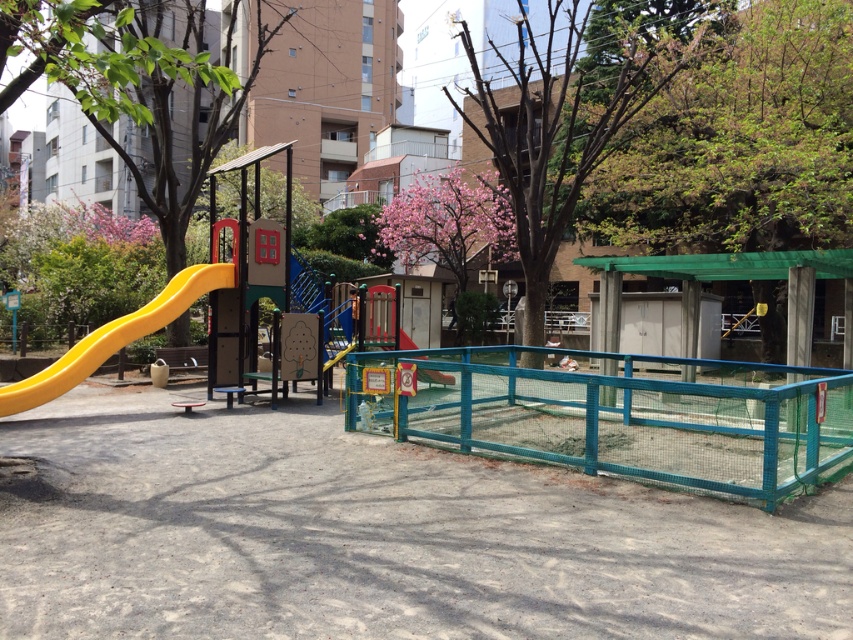
You are a parent trying to guide your child to the yellow matte slide at left from the bare wood tree at center. Which direction should you move relative to the tree?

You should move towards the left relative to the bare wood tree at center because the yellow matte slide at left is positioned to the left side of the frame, while the tree is centrally located.

Based on the photo, you are standing at the playground and want to walk from the slide to the fence. You see two points marked in the image. The first point is at coordinate point (553,83) and the second point is at coordinate point (51,369). Which point is closer to you as you stand at the slide?

Point (553,83) is closer to you because it is further to the viewer than point (51,369), meaning it is nearer in the scene.